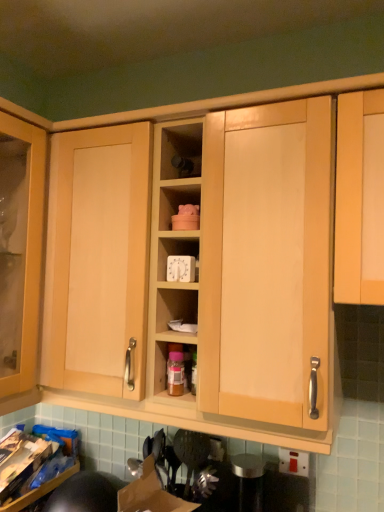
Question: Is white plastic timer at center further to the viewer compared to translucent plastic bottle at center?

Choices:
 (A) yes
 (B) no

Answer: (B)

Question: Considering the relative sizes of white plastic timer at center and translucent plastic bottle at center in the image provided, is white plastic timer at center smaller than translucent plastic bottle at center?

Choices:
 (A) yes
 (B) no

Answer: (B)

Question: Can we say white plastic timer at center lies outside translucent plastic bottle at center?

Choices:
 (A) yes
 (B) no

Answer: (A)

Question: From a real-world perspective, is white plastic timer at center on translucent plastic bottle at center?

Choices:
 (A) no
 (B) yes

Answer: (B)

Question: Is white plastic timer at center far away from translucent plastic bottle at center?

Choices:
 (A) yes
 (B) no

Answer: (B)

Question: Could you tell me if white plastic timer at center is facing translucent plastic bottle at center?

Choices:
 (A) yes
 (B) no

Answer: (B)

Question: Is white plastic timer at center taller than matte wood shelf at center?

Choices:
 (A) yes
 (B) no

Answer: (B)

Question: From a real-world perspective, is white plastic timer at center under matte wood shelf at center?

Choices:
 (A) no
 (B) yes

Answer: (B)

Question: Is white plastic timer at center looking in the opposite direction of matte wood shelf at center?

Choices:
 (A) no
 (B) yes

Answer: (A)

Question: From the image's perspective, would you say white plastic timer at center is positioned over matte wood shelf at center?

Choices:
 (A) no
 (B) yes

Answer: (A)

Question: Does white plastic timer at center appear on the right side of matte wood shelf at center?

Choices:
 (A) yes
 (B) no

Answer: (B)

Question: Can you confirm if white plastic timer at center is positioned to the left of matte wood shelf at center?

Choices:
 (A) no
 (B) yes

Answer: (B)

Question: Is the position of translucent plastic bottle at center less distant than that of matte wood shelf at center?

Choices:
 (A) yes
 (B) no

Answer: (B)